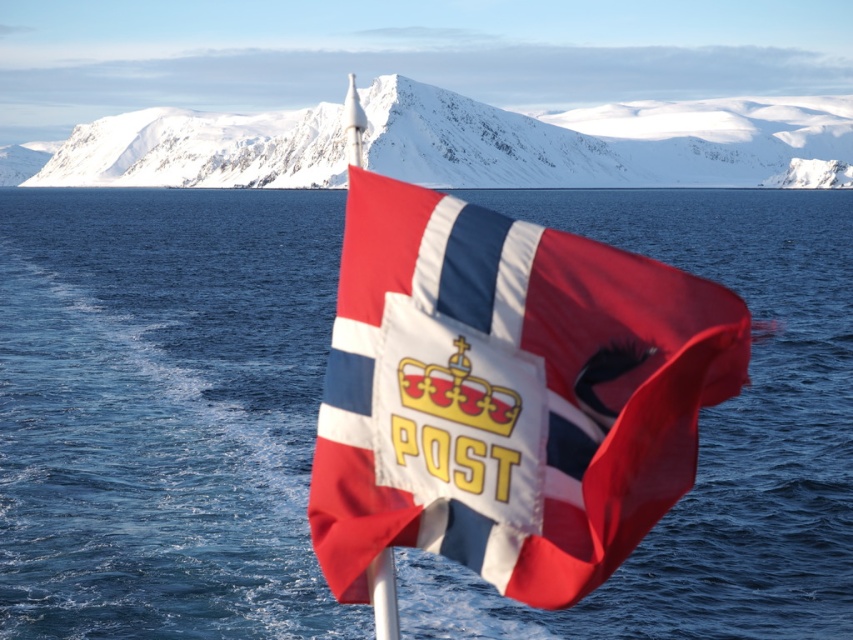
You are a photographer trying to capture the Norwegian flag in the scene. You want to focus on the two points marked in the image. Which point is closer to you, point (163,444) or point (347,186)?

Point (163,444) is closer to the viewer than point (347,186).

In the scene shown: You are a photographer trying to capture the Norwegian flag and the ocean in one shot. Based on the scene, can you confirm if the blue water at center is covering part of the matte fabric flag at center?

The blue water at center is positioned over matte fabric flag at center, so yes, the blue water at center is covering part of the matte fabric flag at center.

You are a sailor navigating a small boat and see the Norwegian flag with the word POST below it. You need to reach the shore behind the flag. Which direction should you steer your boat relative to the blue water at center and the snowy rock at upper center?

You should steer your boat to the right of the blue water at center and the snowy rock at upper center because the blue water at center is positioned on the left side of the snowy rock at upper center, indicating the shore is likely to the right side of these landmarks.